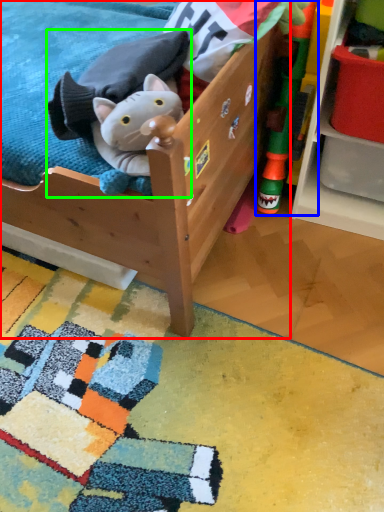
Question: Considering the real-world distances, which object is farthest from furniture (highlighted by a red box)? toy (highlighted by a blue box) or toy (highlighted by a green box)?

Choices:
 (A) toy
 (B) toy

Answer: (A)